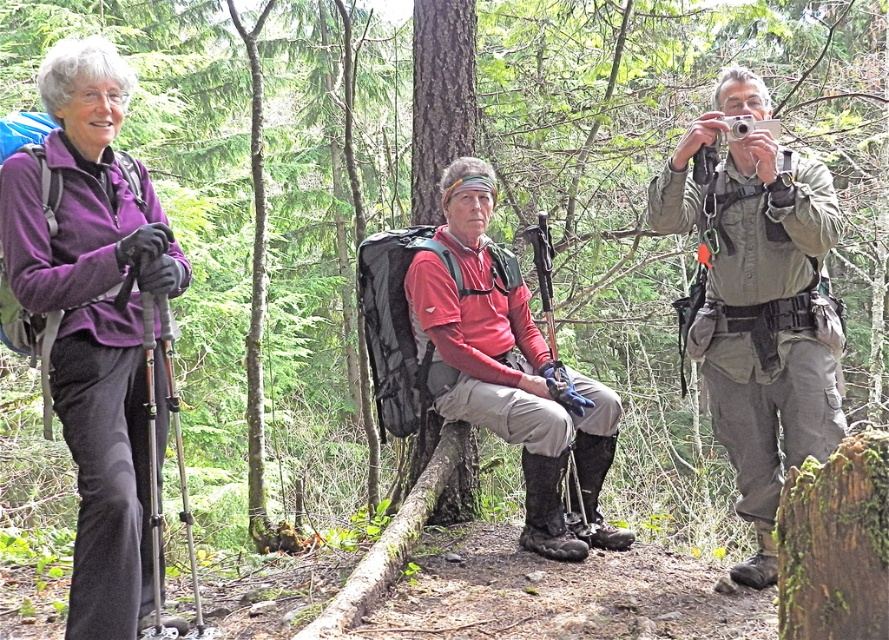
What is the position of the point with coordinates (93, 316) in relation to the purple fleece jacket at left?

The point with coordinates (93, 316) is located on the purple fleece jacket at left.